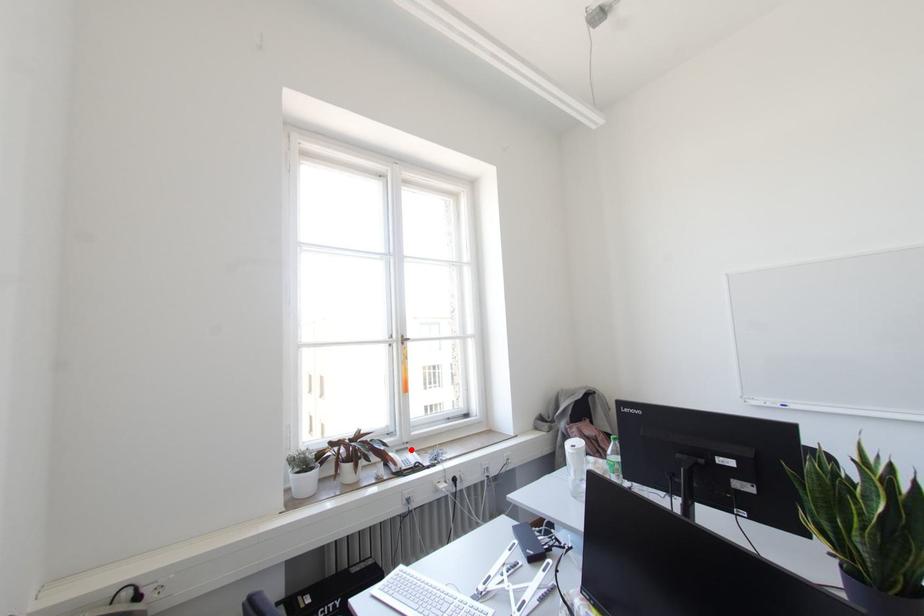
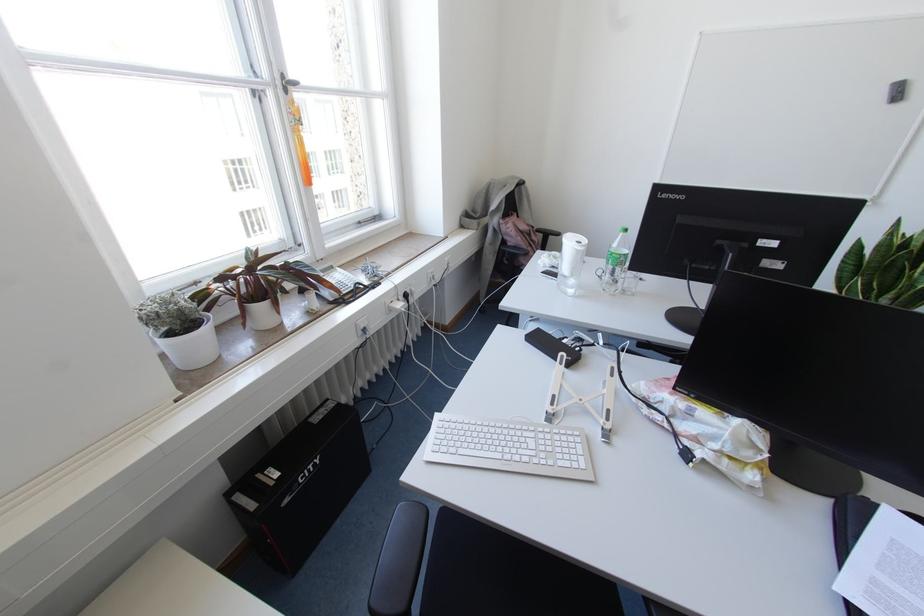
Question: I am providing you with two images of the same scene from different viewpoints. In image1, a red point is highlighted. Considering the same 3D point in image2, which of the following is correct?

Choices:
 (A) It is closer
 (B) It is farther

Answer: (A)